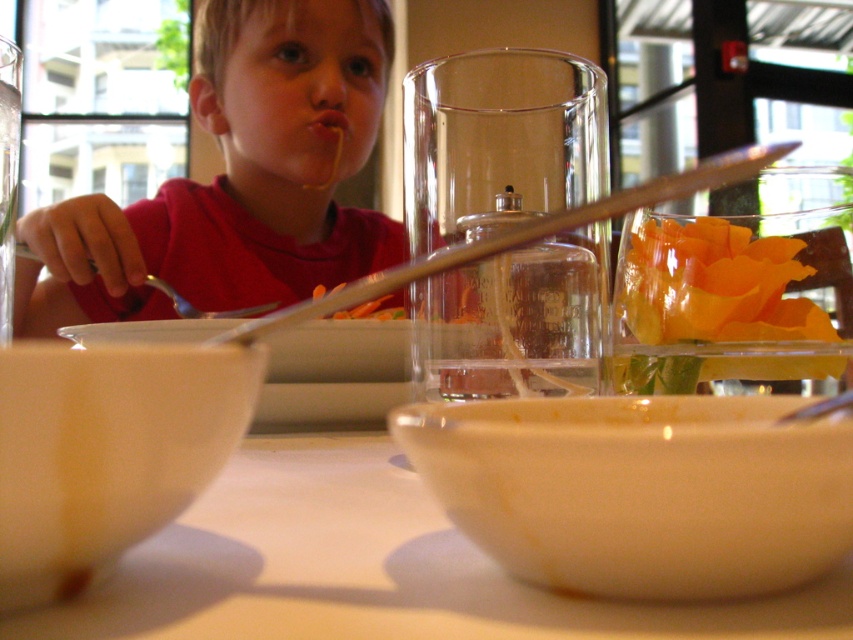
Image resolution: width=853 pixels, height=640 pixels. What do you see at coordinates (640, 490) in the screenshot? I see `white matte bowl at lower center` at bounding box center [640, 490].

Can you confirm if white matte bowl at lower center is positioned to the right of white matte bowl at center?

Yes, white matte bowl at lower center is to the right of white matte bowl at center.

Where is `white matte bowl at lower center`? Image resolution: width=853 pixels, height=640 pixels. white matte bowl at lower center is located at coordinates (640, 490).

Is white matte bowl at lower left to the left of orange translucent chips at right from the viewer's perspective?

Indeed, white matte bowl at lower left is positioned on the left side of orange translucent chips at right.

Which of these two, white matte bowl at lower left or orange translucent chips at right, stands shorter?

white matte bowl at lower left is shorter.

What do you see at coordinates (107, 451) in the screenshot? The height and width of the screenshot is (640, 853). I see `white matte bowl at lower left` at bounding box center [107, 451].

You are a GUI agent. You are given a task and a screenshot of the screen. Output one action in this format:
    pyautogui.click(x=<x>, y=<y>)
    Task: Click on the white matte bowl at lower left
    
    Given the screenshot: What is the action you would take?
    pyautogui.click(x=107, y=451)

In the scene shown: Does matte red shirt at upper left appear over clear glass chopstick at upper center?

Yes, matte red shirt at upper left is above clear glass chopstick at upper center.

Measure the distance between point (347, 65) and camera.

The distance of point (347, 65) from camera is 24.53 inches.

Is point (247, 45) closer to camera compared to point (387, 285)?

No, (247, 45) is behind (387, 285).

Identify the location of matte red shirt at upper left. (236, 179).